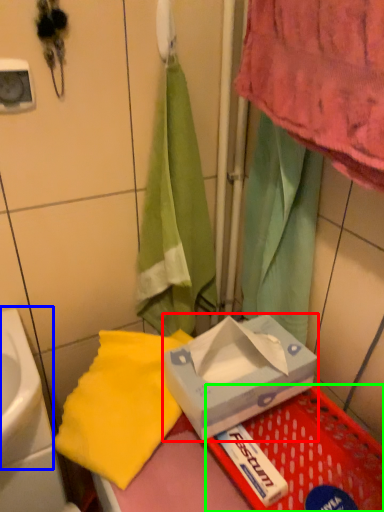
Question: Based on their relative distances, which object is nearer to box (highlighted by a red box)? Choose from sink (highlighted by a blue box) and basket (highlighted by a green box).

Choices:
 (A) sink
 (B) basket

Answer: (B)